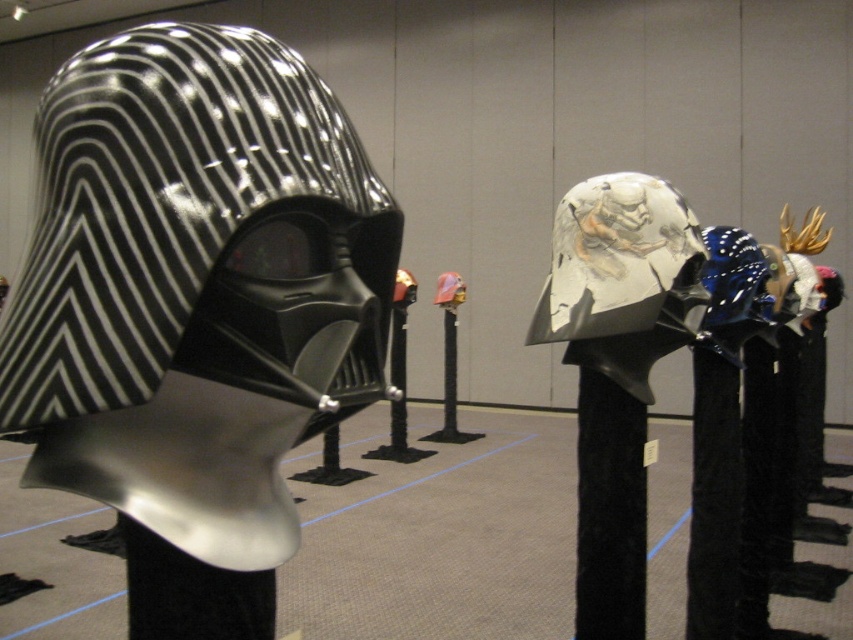
Question: In this image, where is black glossy helmet at left located relative to black velvet post at center?

Choices:
 (A) left
 (B) right

Answer: (A)

Question: Based on their relative distances, which object is farther from the black velvet post at center?

Choices:
 (A) black velvet pillar at center
 (B) black glossy helmet at left

Answer: (B)

Question: Which of the following is the closest to the observer?

Choices:
 (A) black glossy helmet at left
 (B) black velvet post at center
 (C) black velvet pillar at center

Answer: (A)

Question: Which of the following is the closest to the observer?

Choices:
 (A) (724, 436)
 (B) (579, 413)
 (C) (239, 244)

Answer: (C)

Question: Considering the relative positions of black glossy helmet at left and black velvet pillar at center in the image provided, where is black glossy helmet at left located with respect to black velvet pillar at center?

Choices:
 (A) right
 (B) left

Answer: (B)

Question: Does black glossy helmet at left appear over black velvet pillar at center?

Choices:
 (A) no
 (B) yes

Answer: (B)